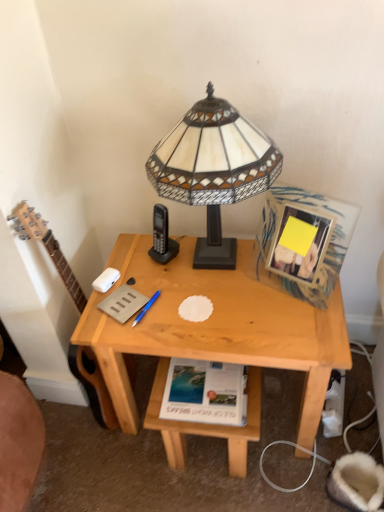
What do you see at coordinates (205, 424) in the screenshot?
I see `natural wood table at lower center` at bounding box center [205, 424].

Describe the element at coordinates (300, 243) in the screenshot. I see `wooden picture frame at upper right` at that location.

What do you see at coordinates (123, 303) in the screenshot? Image resolution: width=384 pixels, height=512 pixels. I see `matte gray paperback book at center, the 1th paperback book positioned from the top` at bounding box center [123, 303].

Find the location of a particular element. This screenshot has height=512, width=384. natural wood table at lower center is located at coordinates (205, 424).

From a real-world perspective, which is physically below, matte gray paperback book at center, marked as the 1th paperback book in a left-to-right arrangement, or wooden acoustic guitar at left?

wooden acoustic guitar at left, from a real-world perspective.

In the image, is matte gray paperback book at center, the 1th paperback book positioned from the top, positioned in front of or behind wooden acoustic guitar at left?

In the image, matte gray paperback book at center, the 1th paperback book positioned from the top, appears behind wooden acoustic guitar at left.

Locate an element on the screen. This screenshot has height=512, width=384. guitar in front of the matte gray paperback book at center, which is the 2th paperback book in right-to-left order is located at coordinates (46, 247).

Is matte gray paperback book at center, arranged as the second paperback book when ordered from the bottom, placed right next to wooden acoustic guitar at left?

matte gray paperback book at center, arranged as the second paperback book when ordered from the bottom, is not next to wooden acoustic guitar at left, and they're not touching.

From the light wood desk at center, count 2nd paperback books backward and point to it. Please provide its 2D coordinates.

[(123, 303)]

Between matte gray paperback book at center, marked as the 1th paperback book in a left-to-right arrangement, and light wood desk at center, which one has less height?

matte gray paperback book at center, marked as the 1th paperback book in a left-to-right arrangement, is shorter.

From a real-world perspective, does matte gray paperback book at center, arranged as the second paperback book when ordered from the bottom, stand above light wood desk at center?

Correct, in the physical world, matte gray paperback book at center, arranged as the second paperback book when ordered from the bottom, is higher than light wood desk at center.

Which object is further away from the camera taking this photo, matte gray paperback book at center, the 1th paperback book positioned from the top, or light wood desk at center?

matte gray paperback book at center, the 1th paperback book positioned from the top, is further away from the camera.

Measure the distance from matte gray paperback book at center, the 1th paperback book positioned from the top, to white paper at lower center, the 2th paperback book viewed from the left.

matte gray paperback book at center, the 1th paperback book positioned from the top, and white paper at lower center, the 2th paperback book viewed from the left, are 10.59 inches apart.

From the image's perspective, which object appears higher, matte gray paperback book at center, marked as the 1th paperback book in a left-to-right arrangement, or white paper at lower center, the first paperback book in the right-to-left sequence?

matte gray paperback book at center, marked as the 1th paperback book in a left-to-right arrangement, appears higher in the image.

Who is smaller, matte gray paperback book at center, the 1th paperback book positioned from the top, or white paper at lower center, the 2th paperback book viewed from the left?

Smaller between the two is matte gray paperback book at center, the 1th paperback book positioned from the top.

From the image's perspective, which is above, wooden picture frame at upper right or wooden acoustic guitar at left?

wooden picture frame at upper right, from the image's perspective.

Which of these two, wooden picture frame at upper right or wooden acoustic guitar at left, is smaller?

wooden picture frame at upper right.

In the image, is wooden picture frame at upper right positioned in front of or behind wooden acoustic guitar at left?

Visually, wooden picture frame at upper right is located behind wooden acoustic guitar at left.

Considering the points (339, 345) and (185, 147), which point is behind, point (339, 345) or point (185, 147)?

The point (339, 345) is more distant.

From the image's perspective, is light wood desk at center above stained glass lampshade at center?

No.

Is light wood desk at center oriented towards stained glass lampshade at center?

No, light wood desk at center is not oriented towards stained glass lampshade at center.

Is stained glass lampshade at center completely or partially inside light wood desk at center?

Actually, stained glass lampshade at center is outside light wood desk at center.

Where is `lamp above the wooden picture frame at upper right (from the image's perspective)`? lamp above the wooden picture frame at upper right (from the image's perspective) is located at coordinates (213, 169).

Does wooden picture frame at upper right have a lesser height compared to stained glass lampshade at center?

Correct, wooden picture frame at upper right is not as tall as stained glass lampshade at center.

In the scene shown: Is wooden picture frame at upper right further to camera compared to stained glass lampshade at center?

Yes, wooden picture frame at upper right is behind stained glass lampshade at center.

Is wooden picture frame at upper right bigger or smaller than stained glass lampshade at center?

Clearly, wooden picture frame at upper right is smaller in size than stained glass lampshade at center.

Which point is more distant from viewer, (98, 386) or (260, 140)?

The point (98, 386) is farther from the camera.

Between wooden acoustic guitar at left and stained glass lampshade at center, which one has more height?

wooden acoustic guitar at left.

Between wooden acoustic guitar at left and stained glass lampshade at center, which one has larger size?

Bigger between the two is stained glass lampshade at center.

How many degrees apart are the facing directions of wooden acoustic guitar at left and stained glass lampshade at center?

The facing directions of wooden acoustic guitar at left and stained glass lampshade at center are 92.4 degrees apart.

Locate an element on the screen. paperback book above the wooden acoustic guitar at left (from the image's perspective) is located at coordinates (123, 303).

Identify the location of desk below the matte gray paperback book at center, which is the 2th paperback book in right-to-left order (from a real-world perspective). Image resolution: width=384 pixels, height=512 pixels. (216, 326).

Consider the image. Based on their spatial positions, is stained glass lampshade at center or matte gray paperback book at center, arranged as the second paperback book when ordered from the bottom, closer to white paper at lower center, the first paperback book in the right-to-left sequence?

matte gray paperback book at center, arranged as the second paperback book when ordered from the bottom, is positioned closer to the anchor white paper at lower center, the first paperback book in the right-to-left sequence.

Considering their positions, is stained glass lampshade at center positioned closer to natural wood table at lower center than white paper at lower center, the first paperback book in the right-to-left sequence?

white paper at lower center, the first paperback book in the right-to-left sequence, is positioned closer to the anchor natural wood table at lower center.

Estimate the real-world distances between objects in this image. Which object is further from light wood desk at center, natural wood table at lower center or wooden picture frame at upper right?

wooden picture frame at upper right is further to light wood desk at center.

Estimate the real-world distances between objects in this image. Which object is closer to wooden picture frame at upper right, stained glass lampshade at center or wooden acoustic guitar at left?

The object closer to wooden picture frame at upper right is stained glass lampshade at center.

Looking at the image, which one is located further to light wood desk at center, white paper at lower center, the first paperback book in the right-to-left sequence, or wooden acoustic guitar at left?

wooden acoustic guitar at left is positioned further to the anchor light wood desk at center.

Based on their spatial positions, is wooden picture frame at upper right or natural wood table at lower center further from wooden acoustic guitar at left?

The object further to wooden acoustic guitar at left is wooden picture frame at upper right.

Estimate the real-world distances between objects in this image. Which object is further from matte gray paperback book at center, which is the 2th paperback book in right-to-left order, white paper at lower center, the first paperback book positioned from the bottom, or natural wood table at lower center?

Among the two, natural wood table at lower center is located further to matte gray paperback book at center, which is the 2th paperback book in right-to-left order.

From the picture: Estimate the real-world distances between objects in this image. Which object is further from natural wood table at lower center, white paper at lower center, the first paperback book positioned from the bottom, or wooden picture frame at upper right?

Among the two, wooden picture frame at upper right is located further to natural wood table at lower center.

The width and height of the screenshot is (384, 512). In order to click on paperback book between stained glass lampshade at center and light wood desk at center from top to bottom in this screenshot , I will do `click(123, 303)`.

Where is `desk that lies between stained glass lampshade at center and natural wood table at lower center from top to bottom`? desk that lies between stained glass lampshade at center and natural wood table at lower center from top to bottom is located at coordinates (216, 326).

Locate an element on the screen. The width and height of the screenshot is (384, 512). desk between wooden acoustic guitar at left and wooden picture frame at upper right is located at coordinates (216, 326).

The image size is (384, 512). Identify the location of paperback book between matte gray paperback book at center, the 1th paperback book positioned from the top, and light wood desk at center, in the horizontal direction. (204, 392).